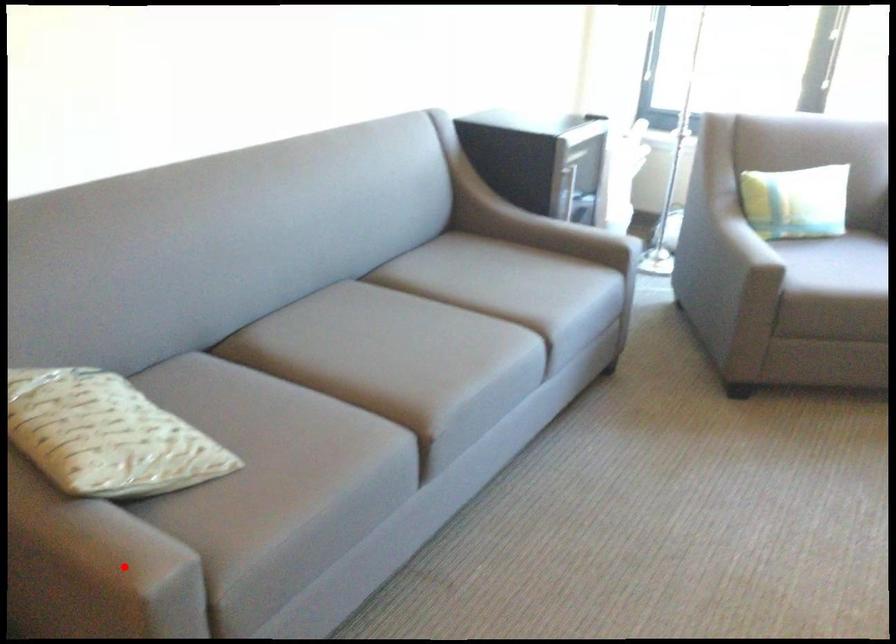
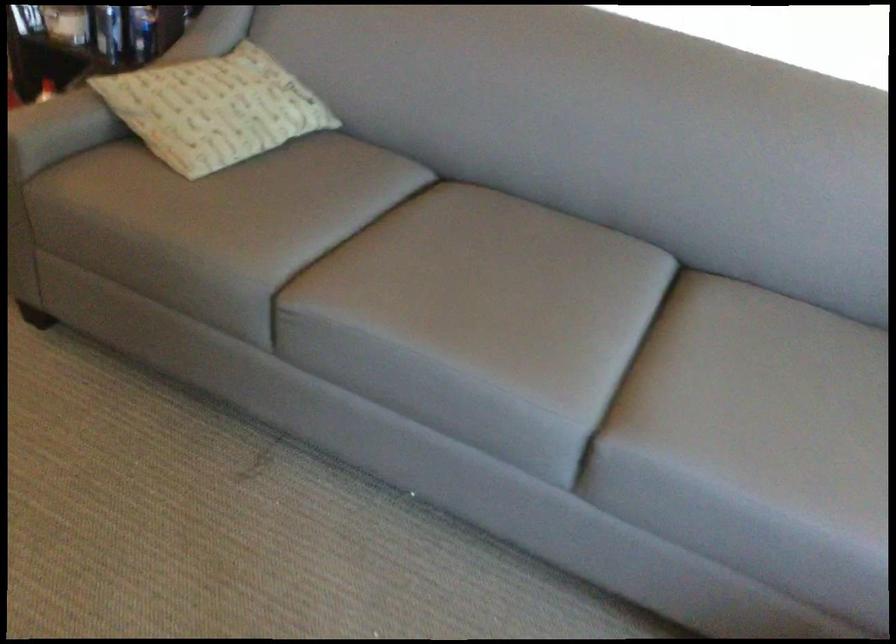
Question: I am providing you with two images of the same scene from different viewpoints. In image1, a red point is highlighted. Considering the same 3D point in image2, which of the following is correct?

Choices:
 (A) It is closer
 (B) It is farther

Answer: (B)